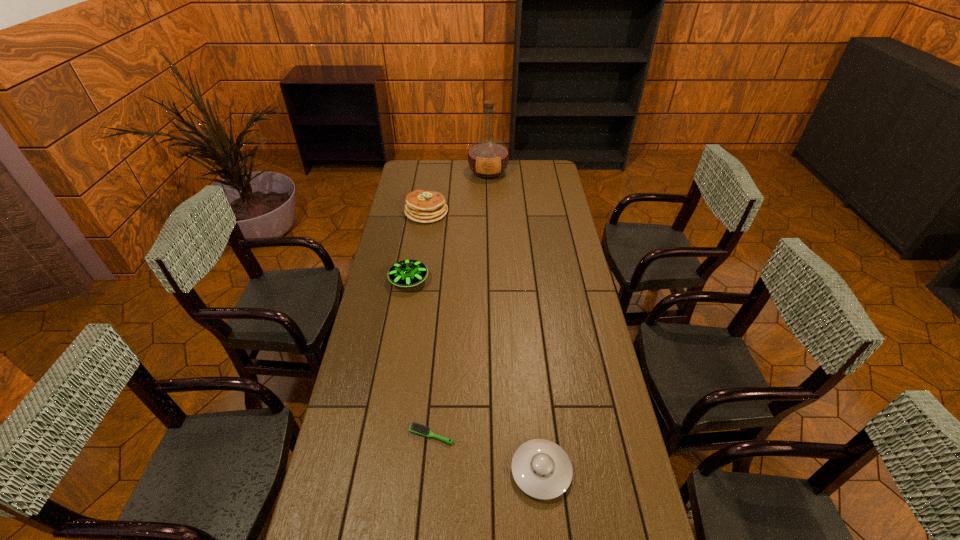
Where is `empty location between the liquor and the third shortest object`? Image resolution: width=960 pixels, height=540 pixels. empty location between the liquor and the third shortest object is located at coordinates [x=448, y=226].

At what (x,y) coordinates should I click in order to perform the action: click on object that is the third closest to the fourth nearest object. Please return your answer as a coordinate pair (x, y). Image resolution: width=960 pixels, height=540 pixels. Looking at the image, I should click on (417, 428).

Identify which object is the third closest to the hairbrush. Please provide its 2D coordinates. Your answer should be formatted as a tuple, i.e. [(x, y)], where the tuple contains the x and y coordinates of a point satisfying the conditions above.

[(421, 206)]

Identify the location of vacant area that satisfies the following two spatial constraints: 1. on the front label of the shorter saucer; 2. on the left side of the liquor. The height and width of the screenshot is (540, 960). (495, 471).

I want to click on free location that satisfies the following two spatial constraints: 1. on the front side of the shortest object; 2. on the left side of the farther saucer, so click(x=382, y=435).

Where is `blank area in the image that satisfies the following two spatial constraints: 1. on the front label of the liquor; 2. on the right side of the nearer saucer`? Image resolution: width=960 pixels, height=540 pixels. blank area in the image that satisfies the following two spatial constraints: 1. on the front label of the liquor; 2. on the right side of the nearer saucer is located at coordinates (495, 471).